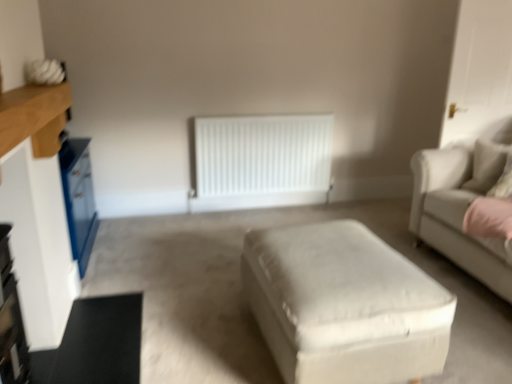
Question: Is white fabric ottoman at center taller or shorter than white wood entertainment center at left?

Choices:
 (A) tall
 (B) short

Answer: (A)

Question: Is white fabric ottoman at center to the left or to the right of white wood entertainment center at left in the image?

Choices:
 (A) right
 (B) left

Answer: (A)

Question: Estimate the real-world distances between objects in this image. Which object is closer to the beige fabric couch at right?

Choices:
 (A) white fabric ottoman at center
 (B) beige fabric pillow at right
 (C) white matte radiator at center
 (D) white wood entertainment center at left

Answer: (B)

Question: Estimate the real-world distances between objects in this image. Which object is farther from the white matte radiator at center?

Choices:
 (A) beige fabric couch at right
 (B) beige fabric pillow at right
 (C) white wood entertainment center at left
 (D) white fabric ottoman at center

Answer: (C)